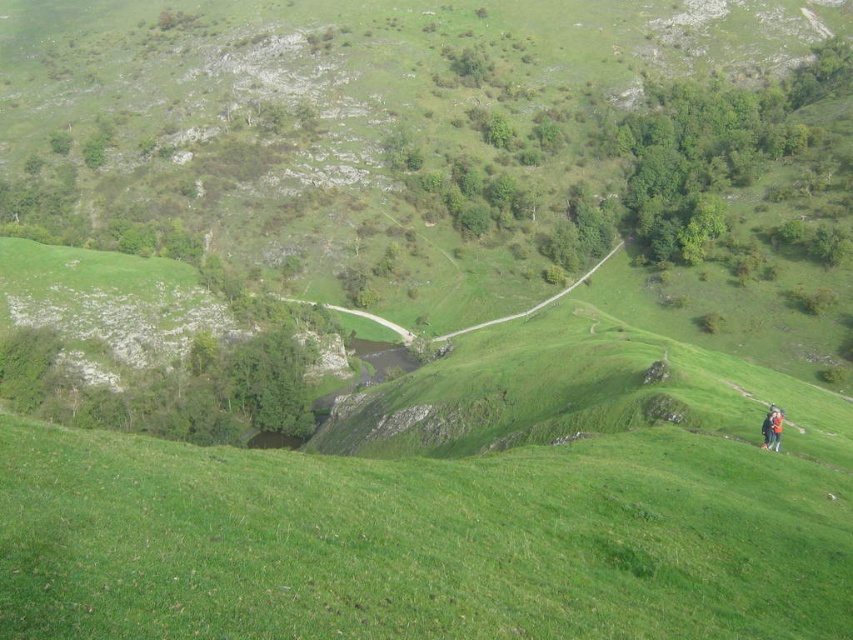
Based on the photo, is green grassy hillside at lower center bigger than orange fabric jacket at lower right?

Indeed, green grassy hillside at lower center has a larger size compared to orange fabric jacket at lower right.

Does point (775, 492) come behind point (775, 432)?

No, (775, 492) is in front of (775, 432).

Which is behind, point (614, 596) or point (775, 420)?

Positioned behind is point (775, 420).

Locate an element on the screen. This screenshot has height=640, width=853. green grassy hillside at lower center is located at coordinates click(x=418, y=541).